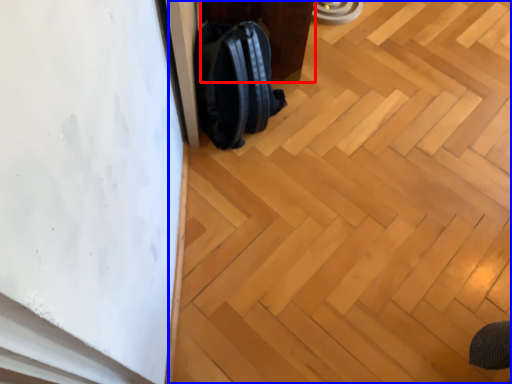
Question: Which object appears farthest to the camera in this image, furniture (highlighted by a red box) or plywood (highlighted by a blue box)?

Choices:
 (A) furniture
 (B) plywood

Answer: (A)